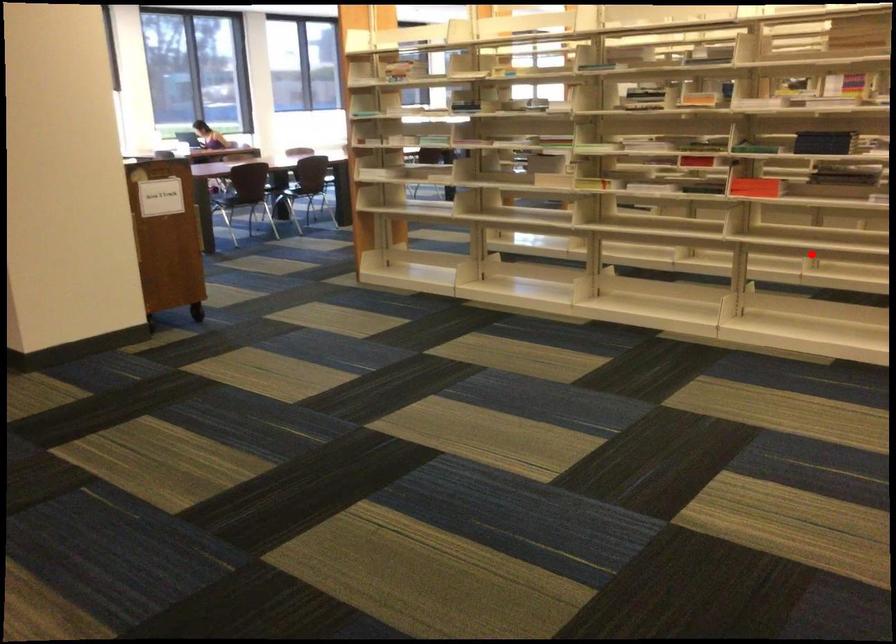
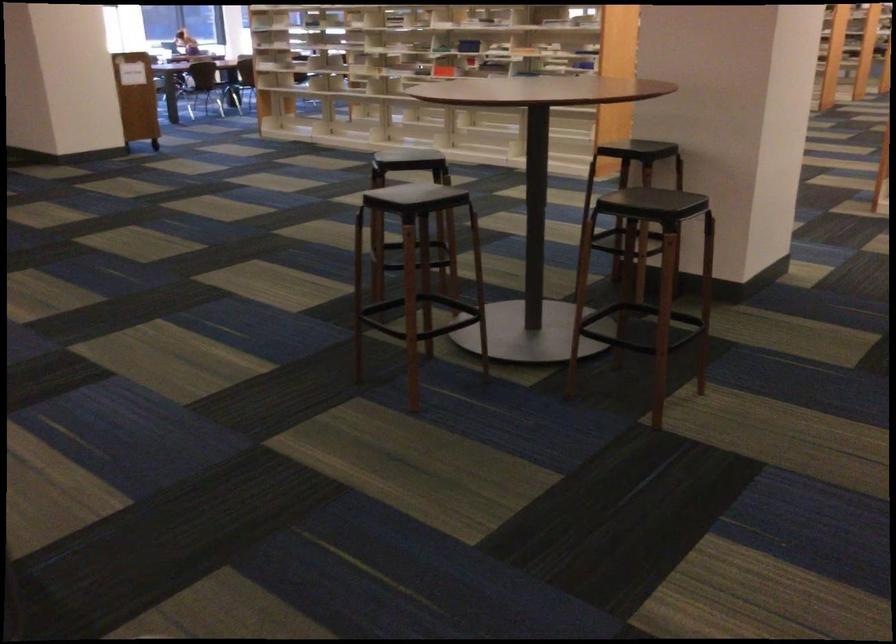
Question: I am providing you with two images of the same scene from different viewpoints. In image1, a red point is highlighted. Considering the same 3D point in image2, which of the following is correct?

Choices:
 (A) It is closer
 (B) It is farther

Answer: (B)